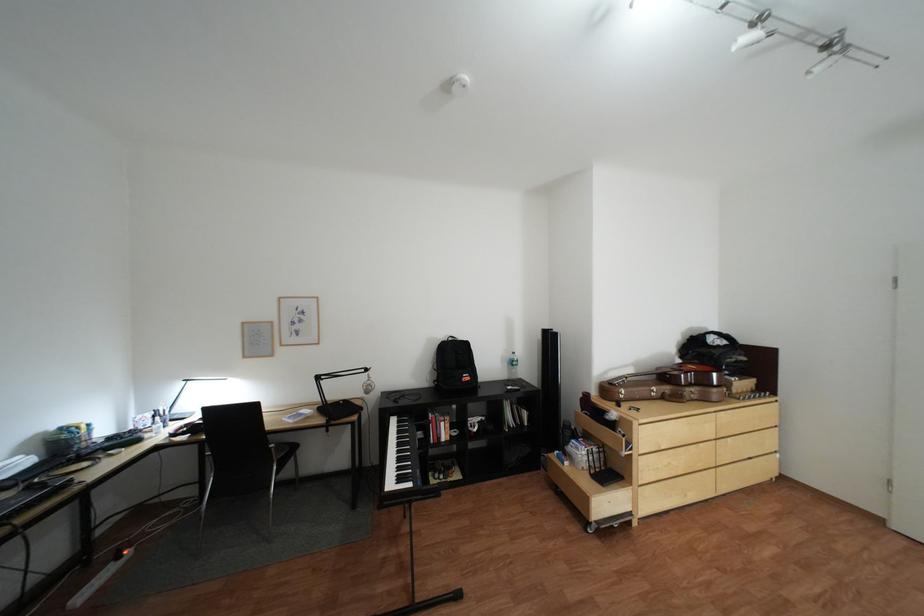
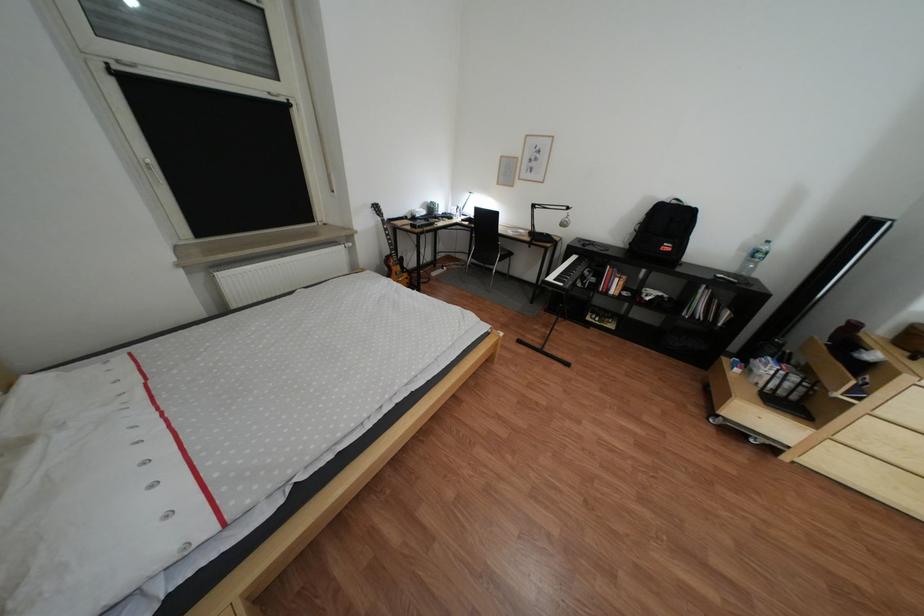
Locate, in the second image, the point that corresponds to point 481,379 in the first image.

(683, 248)